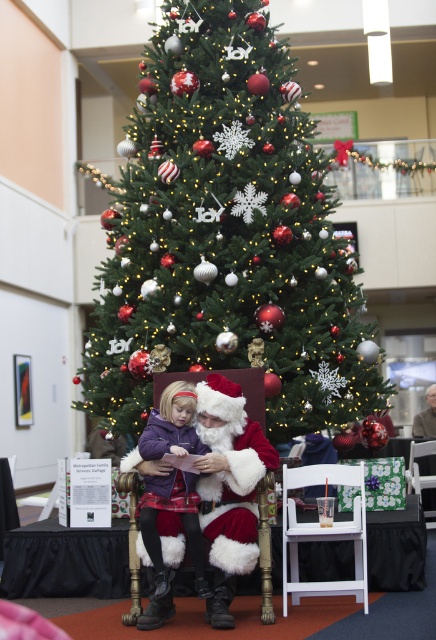
Question: Is white wood chair at lower center bigger than white wood armchair at lower right?

Choices:
 (A) no
 (B) yes

Answer: (B)

Question: Which object is the farthest from the fuzzy red santa at center?

Choices:
 (A) white wood chair at lower center
 (B) white fluffy santa at center

Answer: (B)

Question: In this image, where is green matte christmas tree at center located relative to purple fleece jacket at center?

Choices:
 (A) left
 (B) right

Answer: (B)

Question: Is green matte christmas tree at center above white wood chair at lower center?

Choices:
 (A) yes
 (B) no

Answer: (A)

Question: Which point is closer to the camera?

Choices:
 (A) (88, 381)
 (B) (347, 592)

Answer: (B)

Question: Which object is the farthest from the purple fleece jacket at center?

Choices:
 (A) fuzzy red santa at center
 (B) white wood armchair at lower right
 (C) green matte christmas tree at center
 (D) white wood chair at lower center

Answer: (B)